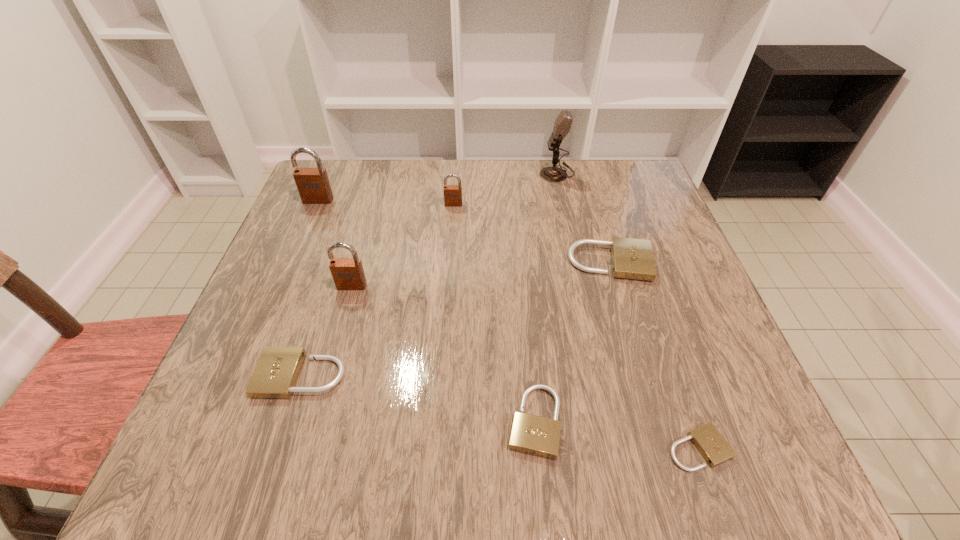
This screenshot has width=960, height=540. Find the location of `the farthest object`. the farthest object is located at coordinates (562, 125).

The image size is (960, 540). Find the location of `the tallest object`. the tallest object is located at coordinates 562,125.

Where is `the biggest brown padlock`? The width and height of the screenshot is (960, 540). the biggest brown padlock is located at coordinates (313, 185).

Image resolution: width=960 pixels, height=540 pixels. Find the location of `the seventh shortest object`. the seventh shortest object is located at coordinates (313, 185).

Locate an element on the screen. This screenshot has width=960, height=540. the nearest brown padlock is located at coordinates (348, 274).

At what (x,y) coordinates should I click in order to perform the action: click on the second smallest brown padlock. Please return your answer as a coordinate pair (x, y). The height and width of the screenshot is (540, 960). Looking at the image, I should click on (348, 274).

This screenshot has width=960, height=540. Find the location of `the rightmost brown padlock`. the rightmost brown padlock is located at coordinates (452, 193).

Where is `the smallest brown padlock`? the smallest brown padlock is located at coordinates (452, 193).

The height and width of the screenshot is (540, 960). I want to click on the fourth shortest object, so click(x=632, y=258).

Where is `the farthest beige padlock`? The height and width of the screenshot is (540, 960). the farthest beige padlock is located at coordinates (632, 258).